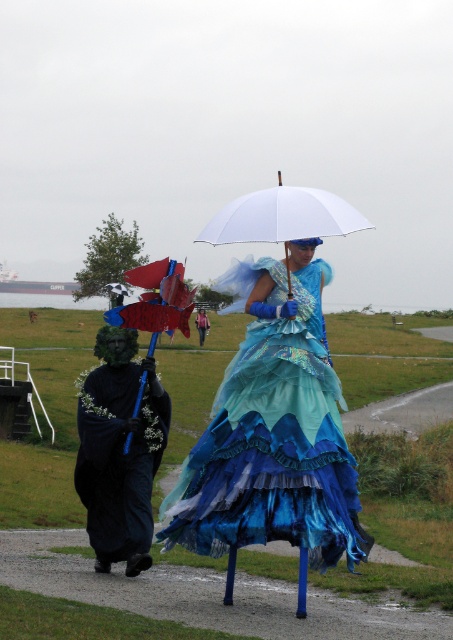
Describe the element at coordinates (274, 429) in the screenshot. This screenshot has height=640, width=453. I see `shiny blue fabric dress at center` at that location.

In the scene shown: Can you confirm if shiny blue fabric dress at center is wider than white matte umbrella at center?

No.

Does point (183, 518) come farther from viewer compared to point (220, 214)?

No, it is not.

Where is `shiny blue fabric dress at center`? The height and width of the screenshot is (640, 453). shiny blue fabric dress at center is located at coordinates (274, 429).

Does white matte umbrella at center have a greater width compared to matte blue umbrella at center?

Yes, white matte umbrella at center is wider than matte blue umbrella at center.

Which is below, white matte umbrella at center or matte blue umbrella at center?

matte blue umbrella at center is below.

Where is `white matte umbrella at center`? white matte umbrella at center is located at coordinates (283, 216).

Does shiny blue fabric dress at center appear over matte blue umbrella at center?

Actually, shiny blue fabric dress at center is below matte blue umbrella at center.

Between shiny blue fabric dress at center and matte blue umbrella at center, which one has more height?

shiny blue fabric dress at center is taller.

Which is in front, point (255, 497) or point (167, 307)?

Point (255, 497) is more forward.

The image size is (453, 640). Identify the location of shiny blue fabric dress at center. (x=274, y=429).